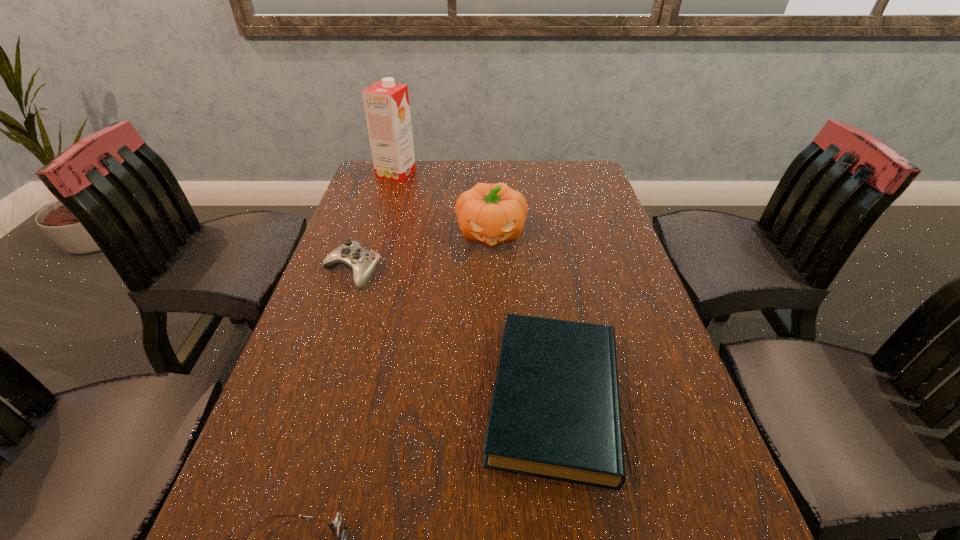
Image resolution: width=960 pixels, height=540 pixels. Identify the location of carton at the left edge. (386, 103).

At what (x,y) coordinates should I click in order to perform the action: click on control located at the left edge. Please return your answer as a coordinate pair (x, y). This screenshot has height=540, width=960. Looking at the image, I should click on (360, 262).

Locate an element on the screen. The height and width of the screenshot is (540, 960). object that is at the right edge is located at coordinates (555, 413).

The width and height of the screenshot is (960, 540). In order to click on object at the far left corner in this screenshot , I will do `click(386, 103)`.

The image size is (960, 540). I want to click on vacant space at the far edge, so click(x=424, y=165).

I want to click on free space at the left edge of the desktop, so click(x=285, y=442).

Identify the location of blank space at the right edge of the desktop. The width and height of the screenshot is (960, 540). (604, 260).

Where is `vacant space at the far right corner of the desktop`? vacant space at the far right corner of the desktop is located at coordinates (591, 180).

Locate an element on the screen. This screenshot has width=960, height=540. free area in between the fourth farthest object and the tallest object is located at coordinates (475, 286).

Identify the location of empty space that is in between the control and the fourth shortest object. click(x=421, y=253).